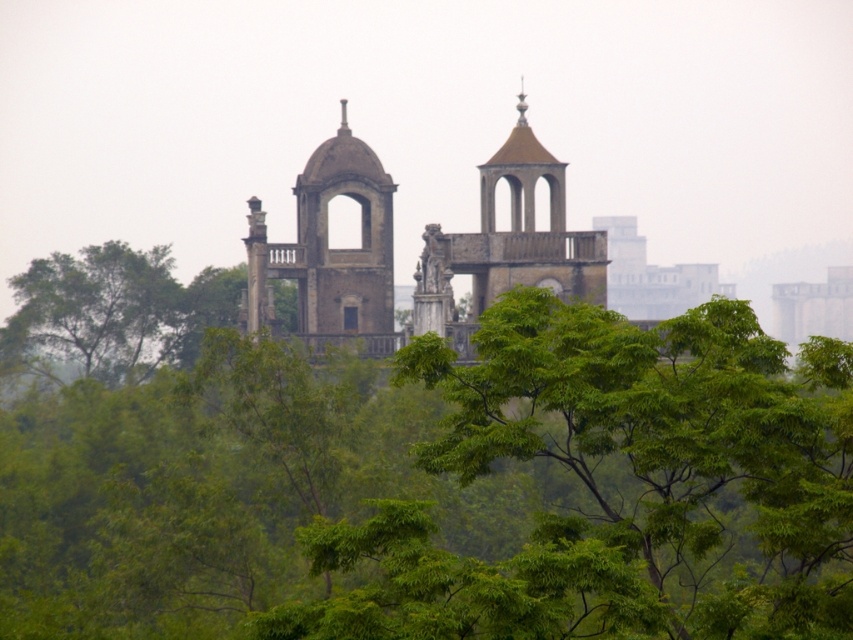
Between point (532, 232) and point (345, 312), which one is positioned in front?

Point (532, 232) is in front.

This screenshot has height=640, width=853. Find the location of `stone church at center`. stone church at center is located at coordinates (329, 252).

Locate an element on the screen. The height and width of the screenshot is (640, 853). stone church at center is located at coordinates (329, 252).

Does stone church at center appear over green leafy tree at upper left?

Correct, stone church at center is located above green leafy tree at upper left.

Can you confirm if stone church at center is smaller than green leafy tree at upper left?

No, stone church at center is not smaller than green leafy tree at upper left.

Consider the image. Who is more distant from viewer, (x=321, y=308) or (x=103, y=248)?

The point (x=103, y=248) is more distant.

The width and height of the screenshot is (853, 640). Find the location of `stone church at center`. stone church at center is located at coordinates (329, 252).

Measure the distance between stone archway at center and brown stone tower at center.

stone archway at center is 10.15 meters away from brown stone tower at center.

Consider the image. Is stone archway at center smaller than brown stone tower at center?

Yes.

Is point (352, 161) behind point (515, 141)?

Yes, it is behind point (515, 141).

You are a GUI agent. You are given a task and a screenshot of the screen. Output one action in this format:
    pyautogui.click(x=<x>, y=<y>)
    Task: Click on the stone archway at center
    This screenshot has width=853, height=640.
    Given the screenshot: What is the action you would take?
    pyautogui.click(x=331, y=252)